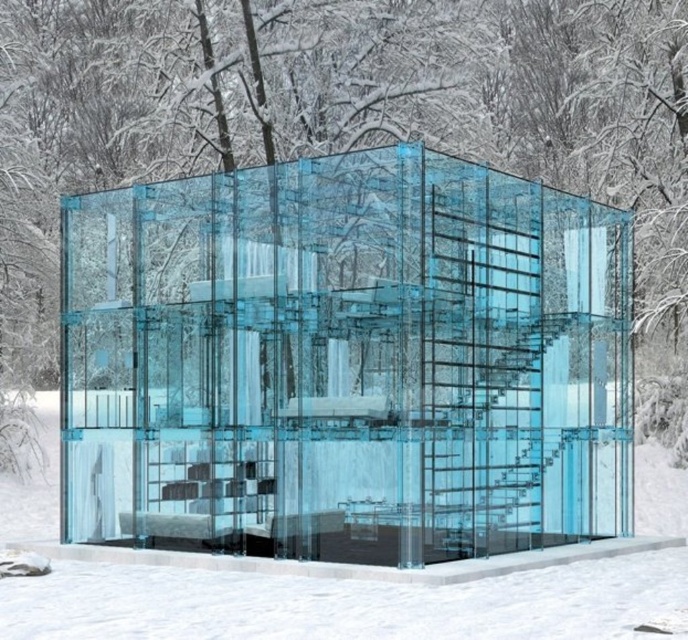
What do you see at coordinates (345, 362) in the screenshot? I see `transparent glass cube at center` at bounding box center [345, 362].

The width and height of the screenshot is (688, 640). What do you see at coordinates (345, 362) in the screenshot? I see `transparent glass cube at center` at bounding box center [345, 362].

Identify the location of transparent glass cube at center. This screenshot has height=640, width=688. (345, 362).